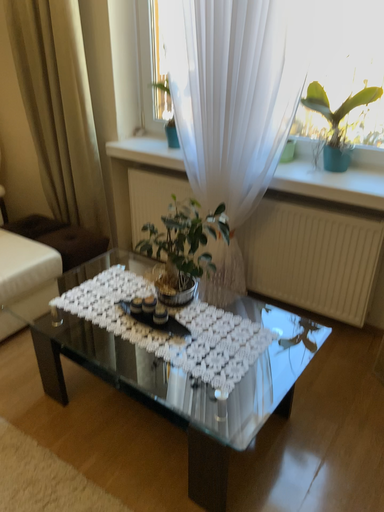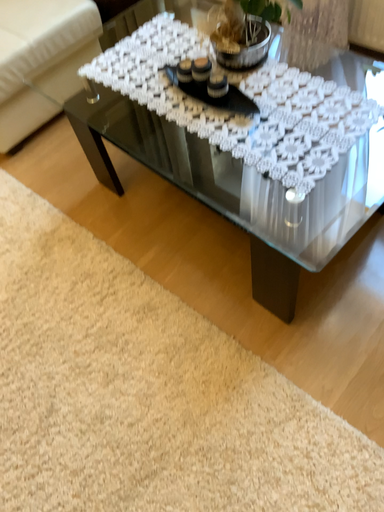
Question: How did the camera likely rotate when shooting the video?

Choices:
 (A) rotated left
 (B) rotated right

Answer: (A)